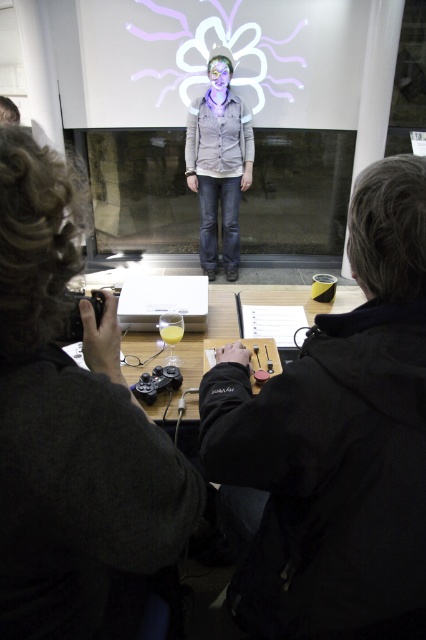
Does black matte jacket at center have a greater height compared to matte gray shirt at center?

Incorrect, black matte jacket at center's height is not larger of matte gray shirt at center's.

Consider the image. Does black matte jacket at center appear under matte gray shirt at center?

Indeed, black matte jacket at center is positioned under matte gray shirt at center.

Is point (261, 563) positioned after point (201, 234)?

No.

The height and width of the screenshot is (640, 426). In order to click on black matte jacket at center in this screenshot , I will do `click(333, 444)`.

Which is below, matte gray shirt at center or wooden table at center?

Positioned lower is wooden table at center.

Which is more to the right, matte gray shirt at center or wooden table at center?

Positioned to the right is wooden table at center.

Who is more forward, (210, 212) or (330, 308)?

Point (330, 308) is more forward.

The width and height of the screenshot is (426, 640). Find the location of `matte gray shirt at center`. matte gray shirt at center is located at coordinates (218, 164).

Does dark gray sweater at lower left have a larger size compared to wooden table at center?

Actually, dark gray sweater at lower left might be smaller than wooden table at center.

Can you confirm if dark gray sweater at lower left is thinner than wooden table at center?

Yes.

Measure the distance between dark gray sweater at lower left and camera.

18.59 inches

This screenshot has height=640, width=426. Identify the location of dark gray sweater at lower left. (71, 435).